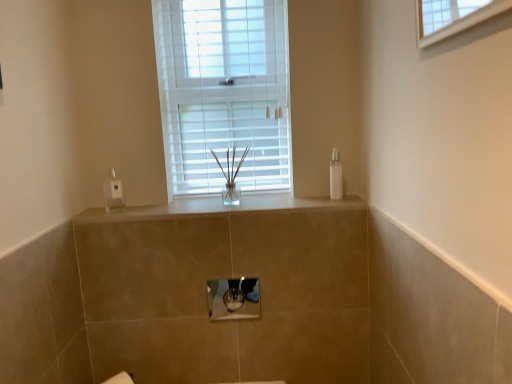
Question: Is satin beige countertop at center far away from clear plastic bottle at right?

Choices:
 (A) no
 (B) yes

Answer: (A)

Question: Does satin beige countertop at center lie in front of clear plastic bottle at right?

Choices:
 (A) yes
 (B) no

Answer: (A)

Question: From a real-world perspective, does satin beige countertop at center stand above clear plastic bottle at right?

Choices:
 (A) no
 (B) yes

Answer: (A)

Question: Is satin beige countertop at center turned away from clear plastic bottle at right?

Choices:
 (A) no
 (B) yes

Answer: (A)

Question: Is satin beige countertop at center smaller than clear plastic bottle at right?

Choices:
 (A) yes
 (B) no

Answer: (B)

Question: Looking at their shapes, would you say metallic silver medicine cabinet at center is wider or thinner than clear plastic soap dispenser at left?

Choices:
 (A) thin
 (B) wide

Answer: (A)

Question: From their relative heights in the image, would you say metallic silver medicine cabinet at center is taller or shorter than clear plastic soap dispenser at left?

Choices:
 (A) short
 (B) tall

Answer: (A)

Question: Considering the positions of metallic silver medicine cabinet at center and clear plastic soap dispenser at left in the image, is metallic silver medicine cabinet at center bigger or smaller than clear plastic soap dispenser at left?

Choices:
 (A) small
 (B) big

Answer: (B)

Question: Is metallic silver medicine cabinet at center inside or outside of clear plastic soap dispenser at left?

Choices:
 (A) inside
 (B) outside

Answer: (B)

Question: Considering the positions of white plastic window at center and clear plastic soap dispenser at left in the image, is white plastic window at center taller or shorter than clear plastic soap dispenser at left?

Choices:
 (A) short
 (B) tall

Answer: (B)

Question: Is white plastic window at center to the left or to the right of clear plastic soap dispenser at left in the image?

Choices:
 (A) left
 (B) right

Answer: (B)

Question: Would you say white plastic window at center is inside or outside clear plastic soap dispenser at left?

Choices:
 (A) inside
 (B) outside

Answer: (B)

Question: From a real-world perspective, is white plastic window at center positioned above or below clear plastic soap dispenser at left?

Choices:
 (A) below
 (B) above

Answer: (B)

Question: In the image, is clear plastic soap dispenser at left positioned in front of or behind metallic silver medicine cabinet at center?

Choices:
 (A) behind
 (B) front

Answer: (A)

Question: Is point (119, 182) closer or farther from the camera than point (211, 301)?

Choices:
 (A) farther
 (B) closer

Answer: (A)